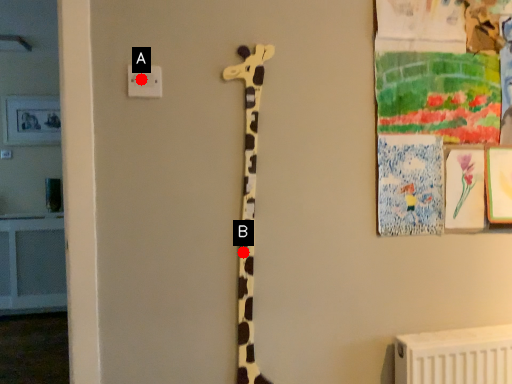
Question: Two points are circled on the image, labeled by A and B beside each circle. Which point is further to the camera?

Choices:
 (A) A is further
 (B) B is further

Answer: (B)